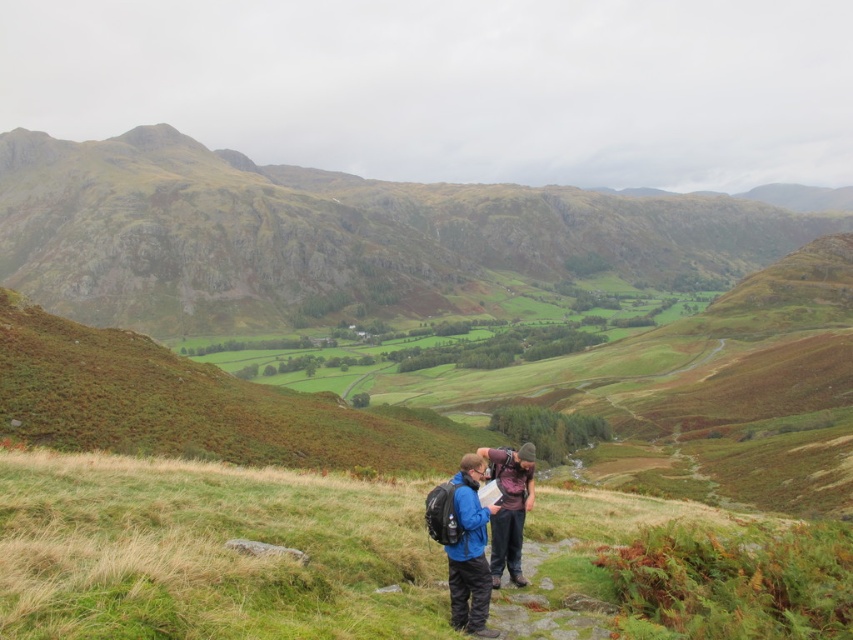
Question: Can you confirm if rugged stone mountain at center is wider than matte purple shirt at center?

Choices:
 (A) no
 (B) yes

Answer: (B)

Question: Estimate the real-world distances between objects in this image. Which object is farther from the blue fabric backpack at center?

Choices:
 (A) rugged stone mountain at center
 (B) matte purple shirt at center

Answer: (A)

Question: Which point is farther to the camera?

Choices:
 (A) green grassy at center
 (B) matte purple shirt at center
 (C) blue fabric backpack at center

Answer: (B)

Question: Which point is closer to the camera?

Choices:
 (A) (540, 202)
 (B) (502, 540)

Answer: (B)

Question: Where is rugged stone mountain at center located in relation to matte purple shirt at center in the image?

Choices:
 (A) below
 (B) above

Answer: (B)

Question: Does blue fabric backpack at center appear over matte purple shirt at center?

Choices:
 (A) no
 (B) yes

Answer: (A)